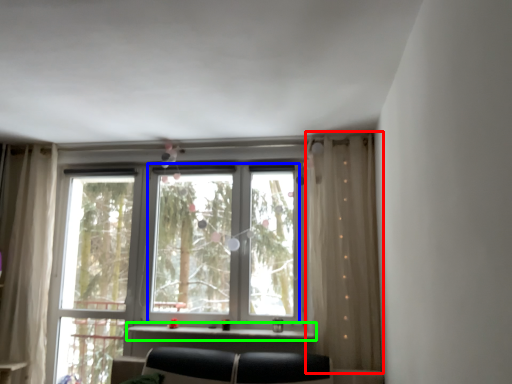
Question: Considering the real-world distances, which object is farthest from curtain (highlighted by a red box)? bay window (highlighted by a blue box) or window sill (highlighted by a green box)?

Choices:
 (A) bay window
 (B) window sill

Answer: (B)